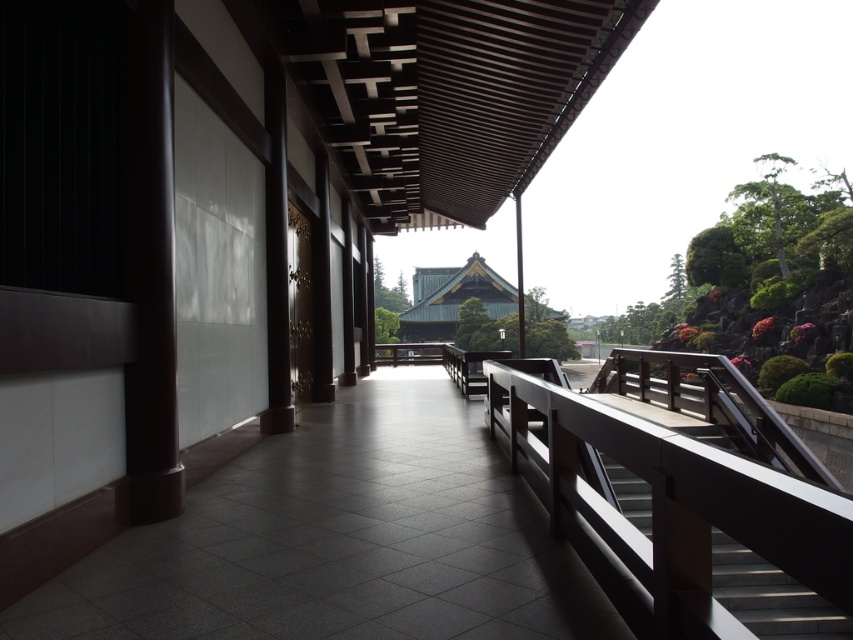
You are a visitor walking along the corridor in the temple complex and need to reach the distant temple with the green tiled roof. You have two options to proceed forward. One is to walk along the smooth concrete path at center, and the other is to walk along the smooth brown wooden rail at right. Which path will require fewer steps to reach the temple?

The smooth concrete path at center is shorter than the smooth brown wooden rail at right, so walking along the smooth concrete path at center will require fewer steps to reach the temple.

You are a tourist visiting the temple and want to take a photo of the green tiled roof building in the distance. To get the best shot, you need to stand on either the smooth brown wooden rail at right or the smooth wooden stair at center. Which object should you choose to stand on to ensure you can see the building clearly?

The smooth brown wooden rail at right has a larger size compared to the smooth wooden stair at center, so standing on the smooth brown wooden rail at right would provide a better vantage point to see the green tiled roof building clearly.